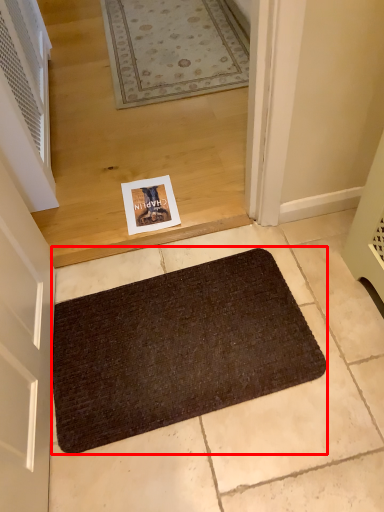
Question: Where is bath mat (annotated by the red box) located in relation to air conditioner in the image?

Choices:
 (A) left
 (B) right

Answer: (B)